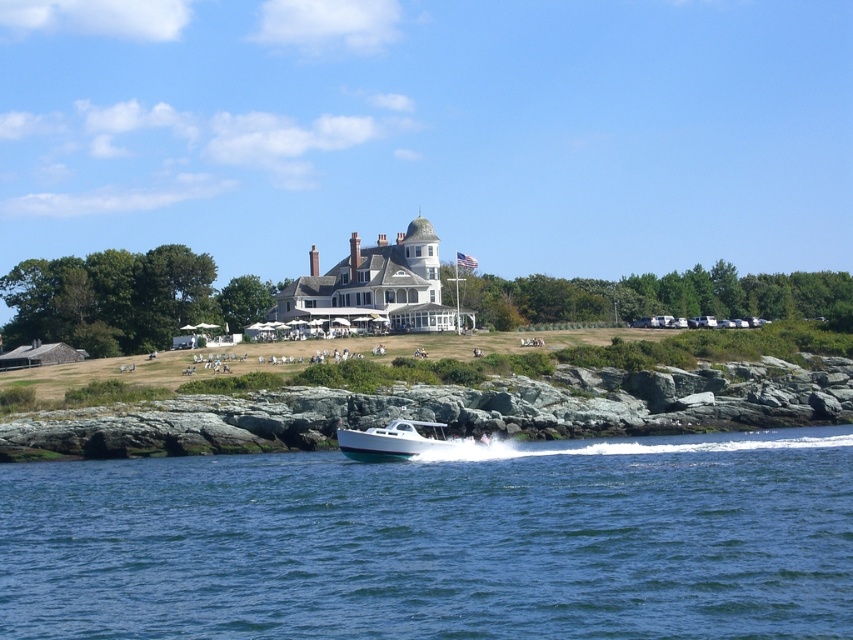
The height and width of the screenshot is (640, 853). What do you see at coordinates (439, 541) in the screenshot?
I see `blue water at lower center` at bounding box center [439, 541].

Between blue water at lower center and white glossy boat at center, which one is positioned lower?

blue water at lower center

Between point (276, 544) and point (422, 422), which one is positioned behind?

The point (422, 422) is behind.

Locate an element on the screen. This screenshot has height=640, width=853. blue water at lower center is located at coordinates (439, 541).

What do you see at coordinates (439, 541) in the screenshot?
I see `blue water at lower center` at bounding box center [439, 541].

Describe the element at coordinates (439, 541) in the screenshot. Image resolution: width=853 pixels, height=640 pixels. I see `blue water at lower center` at that location.

Locate an element on the screen. Image resolution: width=853 pixels, height=640 pixels. blue water at lower center is located at coordinates (439, 541).

Which of these two, white wooden mansion at center or white glossy boat at center, stands taller?

white wooden mansion at center

Can you confirm if white wooden mansion at center is positioned above white glossy boat at center?

Indeed, white wooden mansion at center is positioned over white glossy boat at center.

The width and height of the screenshot is (853, 640). What do you see at coordinates (367, 292) in the screenshot? I see `white wooden mansion at center` at bounding box center [367, 292].

This screenshot has height=640, width=853. I want to click on white wooden mansion at center, so click(x=367, y=292).